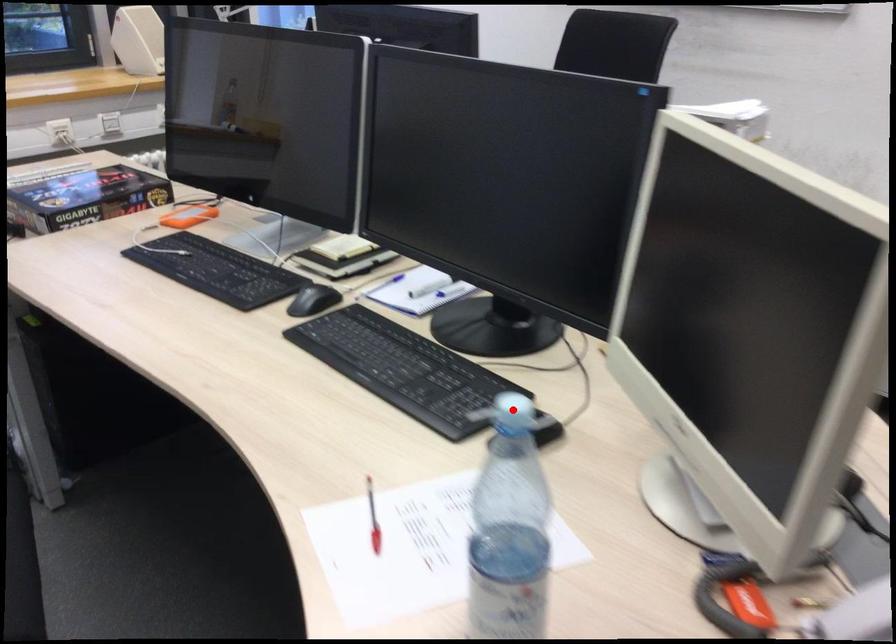
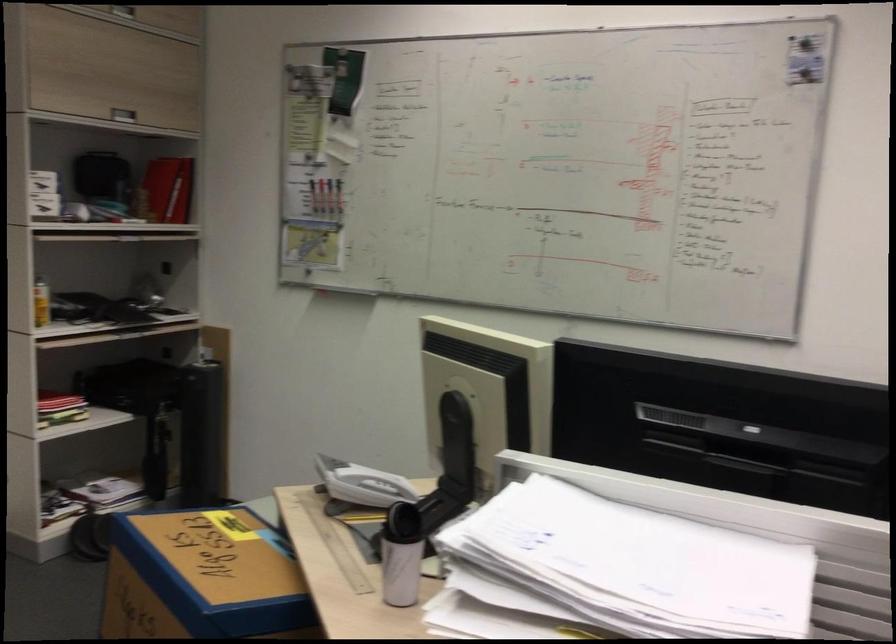
Question: I am providing you with two images of the same scene from different viewpoints. A red point is marked on the first image. At the location where the point appears in image 1, is it still visible in image 2?

Choices:
 (A) Yes
 (B) No

Answer: (B)